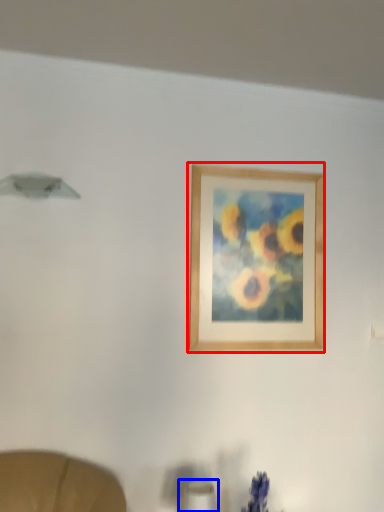
Question: Which object is closer to the camera taking this photo, picture frame (highlighted by a red box) or table lamp (highlighted by a blue box)?

Choices:
 (A) picture frame
 (B) table lamp

Answer: (B)